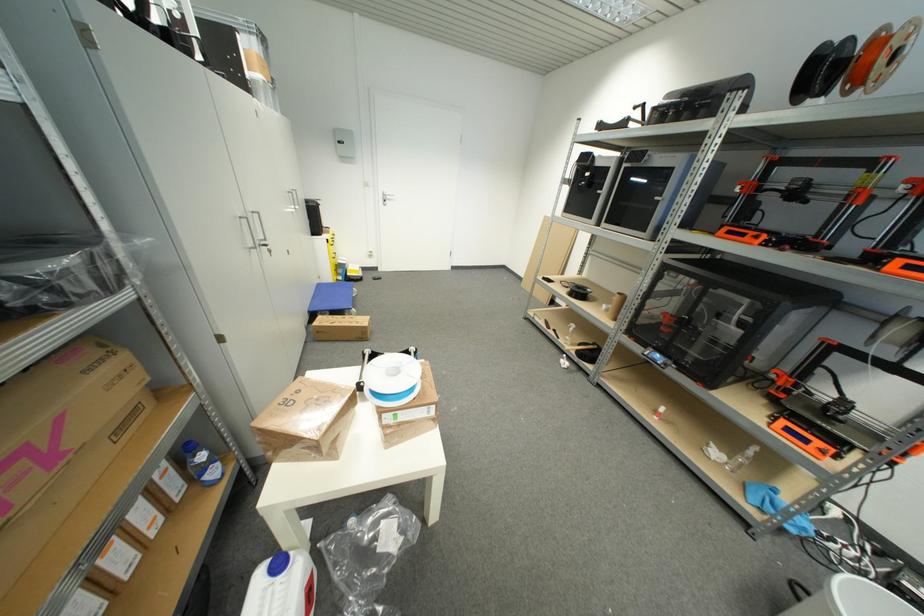
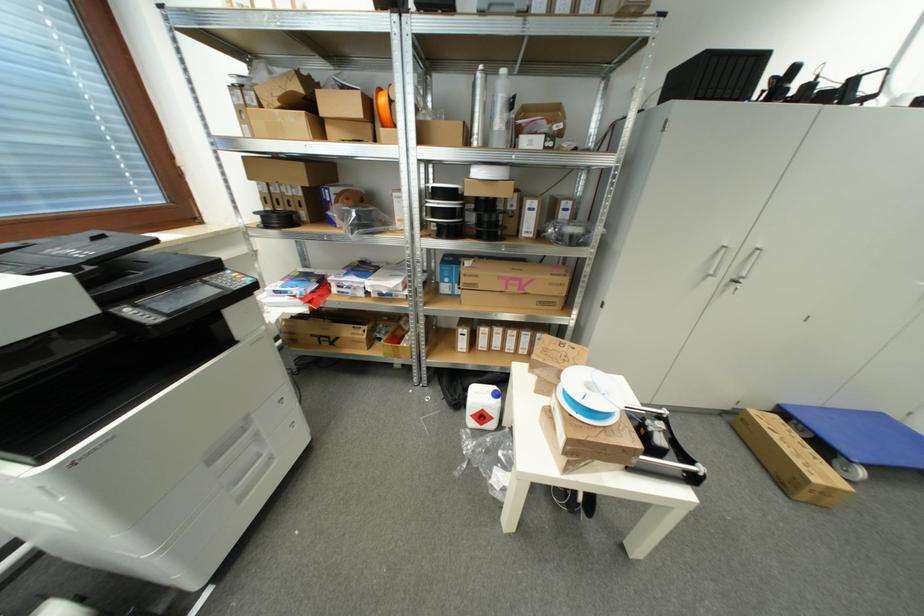
The images are taken continuously from a first-person perspective. In which direction is your viewpoint rotating?

The camera's rotation is toward left-down.